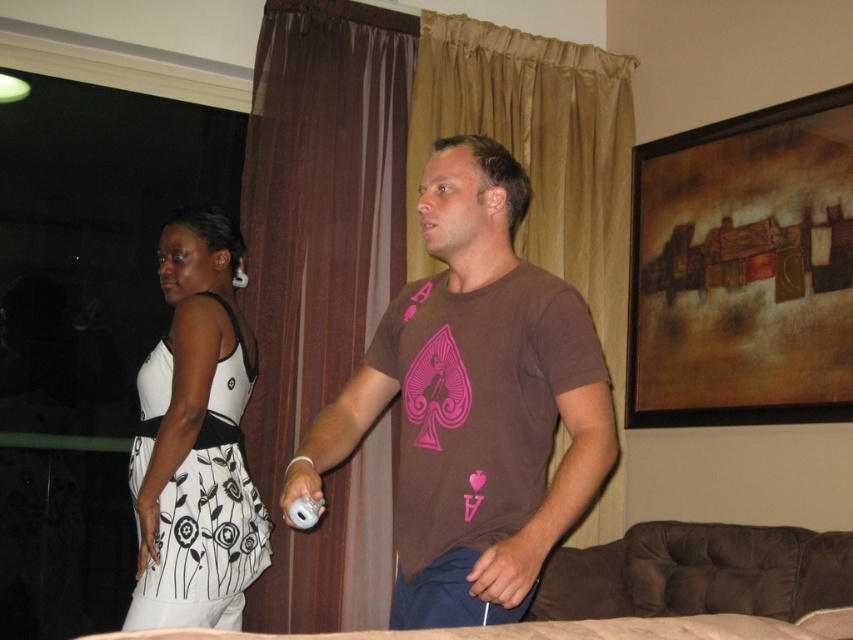
Which of these two, white floral dress at left or white matte wii controller at center, stands taller?

white floral dress at left

Between white floral dress at left and white matte wii controller at center, which one has less height?

Standing shorter between the two is white matte wii controller at center.

Is point (231, 339) positioned behind point (314, 513)?

Yes.

Find the location of a particular element. white floral dress at left is located at coordinates click(196, 440).

How far apart are beige satin curtain at center and white floral dress at left?

1.19 meters

Find the location of `beige satin curtain at center`. beige satin curtain at center is located at coordinates (537, 152).

Does brown matte t-shirt at center have a greater height compared to white floral dress at left?

No, brown matte t-shirt at center is not taller than white floral dress at left.

Is brown matte t-shirt at center shorter than white floral dress at left?

Indeed, brown matte t-shirt at center has a lesser height compared to white floral dress at left.

Does point (469, 176) lie behind point (206, 538)?

No, (469, 176) is closer to viewer.

This screenshot has height=640, width=853. Identify the location of brown matte t-shirt at center. pyautogui.click(x=474, y=403).